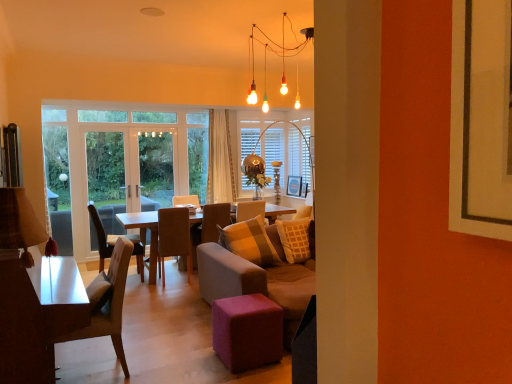
Question: Is translucent glass window at center wider than transparent glass door at left, placed as the 1th screen door when sorted from left to right?

Choices:
 (A) no
 (B) yes

Answer: (B)

Question: Is transparent glass door at left, placed as the second screen door when sorted from right to left, inside translucent glass window at center?

Choices:
 (A) no
 (B) yes

Answer: (A)

Question: Is translucent glass window at center in front of transparent glass door at left, placed as the 1th screen door when sorted from left to right?

Choices:
 (A) yes
 (B) no

Answer: (B)

Question: Is the surface of translucent glass window at center in direct contact with transparent glass door at left, placed as the second screen door when sorted from right to left?

Choices:
 (A) no
 (B) yes

Answer: (A)

Question: Can you confirm if translucent glass window at center is thinner than transparent glass door at left, placed as the second screen door when sorted from right to left?

Choices:
 (A) no
 (B) yes

Answer: (A)

Question: Is transparent glass door at left, placed as the 1th screen door when sorted from left to right, to the left or to the right of velvet beige couch at center in the image?

Choices:
 (A) right
 (B) left

Answer: (B)

Question: From the image's perspective, is transparent glass door at left, placed as the second screen door when sorted from right to left, positioned above or below velvet beige couch at center?

Choices:
 (A) above
 (B) below

Answer: (A)

Question: Is point (93, 142) closer or farther from the camera than point (285, 269)?

Choices:
 (A) closer
 (B) farther

Answer: (B)

Question: Based on their sizes in the image, would you say transparent glass door at left, placed as the second screen door when sorted from right to left, is bigger or smaller than velvet beige couch at center?

Choices:
 (A) small
 (B) big

Answer: (A)

Question: Considering the positions of velvet beige couch at center and clear glass door at center, positioned as the 2th screen door in left-to-right order, in the image, is velvet beige couch at center bigger or smaller than clear glass door at center, positioned as the 2th screen door in left-to-right order,?

Choices:
 (A) big
 (B) small

Answer: (A)

Question: Looking at their shapes, would you say velvet beige couch at center is wider or thinner than clear glass door at center, marked as the 1th screen door in a right-to-left arrangement?

Choices:
 (A) thin
 (B) wide

Answer: (B)

Question: Considering the relative positions of velvet beige couch at center and clear glass door at center, marked as the 1th screen door in a right-to-left arrangement, in the image provided, is velvet beige couch at center to the left or to the right of clear glass door at center, marked as the 1th screen door in a right-to-left arrangement,?

Choices:
 (A) left
 (B) right

Answer: (B)

Question: From a real-world perspective, relative to clear glass door at center, marked as the 1th screen door in a right-to-left arrangement, is velvet beige couch at center vertically above or below?

Choices:
 (A) below
 (B) above

Answer: (A)

Question: Is point (203, 205) closer or farther from the camera than point (281, 208)?

Choices:
 (A) closer
 (B) farther

Answer: (B)

Question: From the image's perspective, is velvet brown chair at center, which is the first chair from back to front, located above or below wooden coffee table at center?

Choices:
 (A) above
 (B) below

Answer: (A)